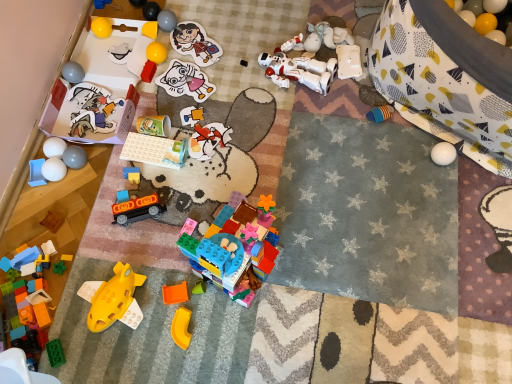
Where is `vacant region to the right of yellow matte plastic arch at center, which appears as the 21th toy when viewed from the left`? vacant region to the right of yellow matte plastic arch at center, which appears as the 21th toy when viewed from the left is located at coordinates (238, 332).